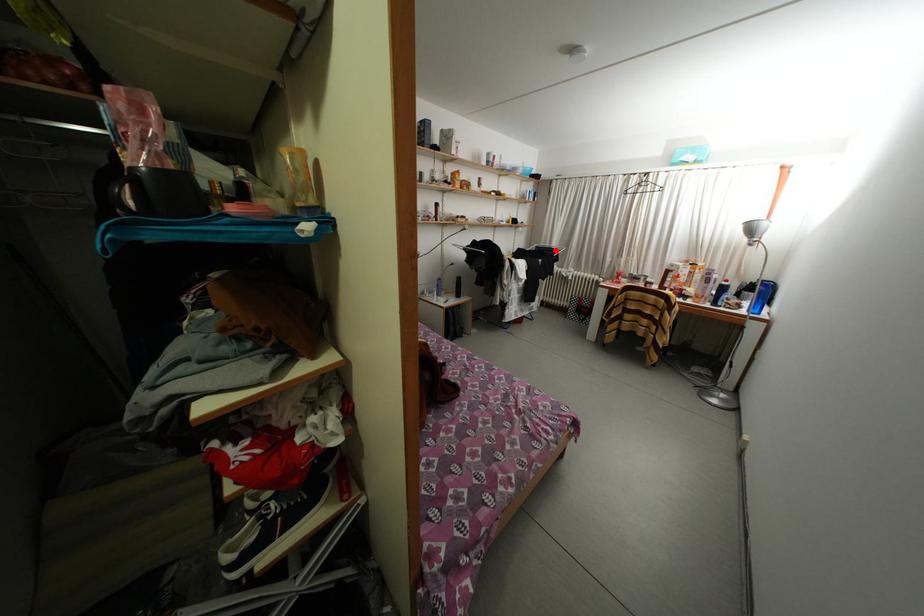
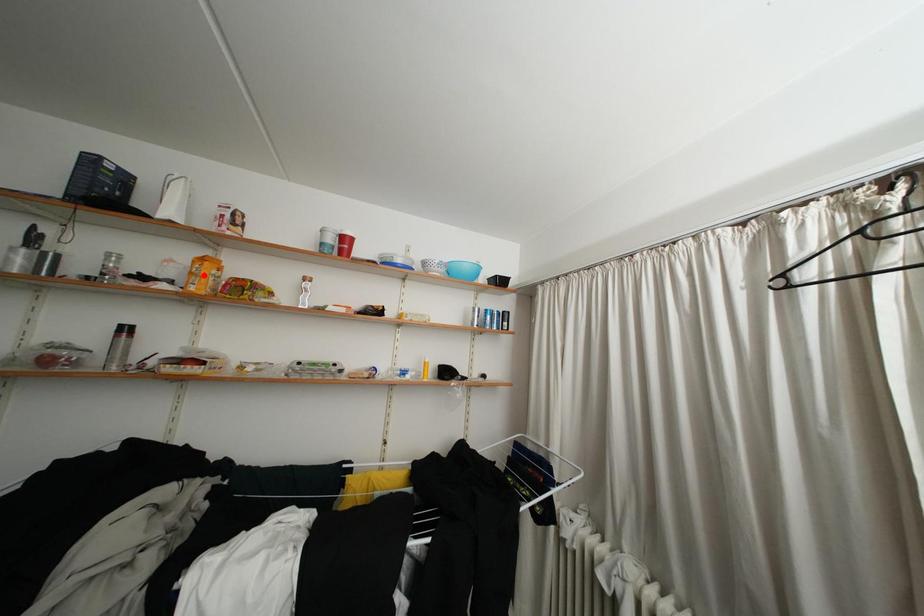
I am providing you with two images of the same scene from different viewpoints. A red point is marked on the first image and another point is marked on the second image. Do the highlighted points in image1 and image2 indicate the same real-world spot?

No